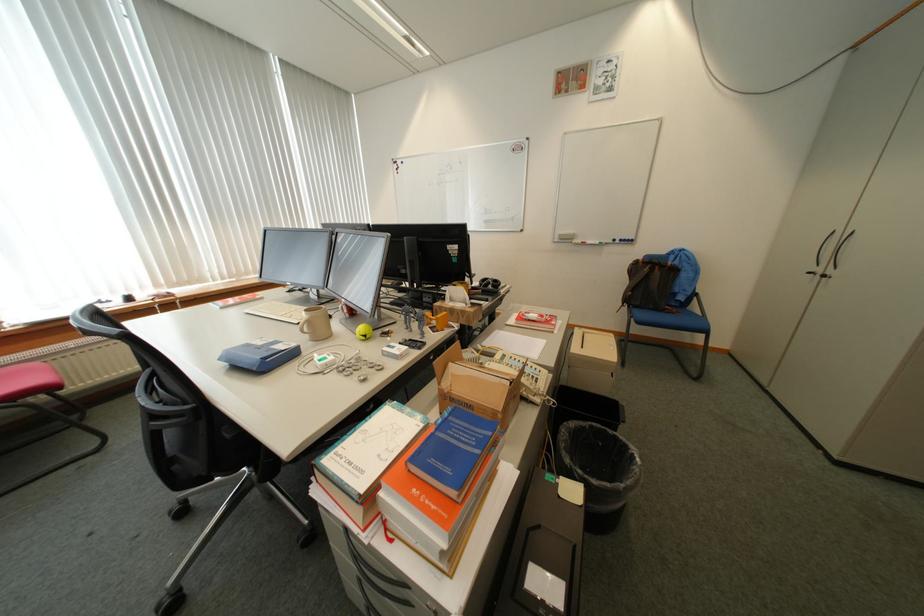
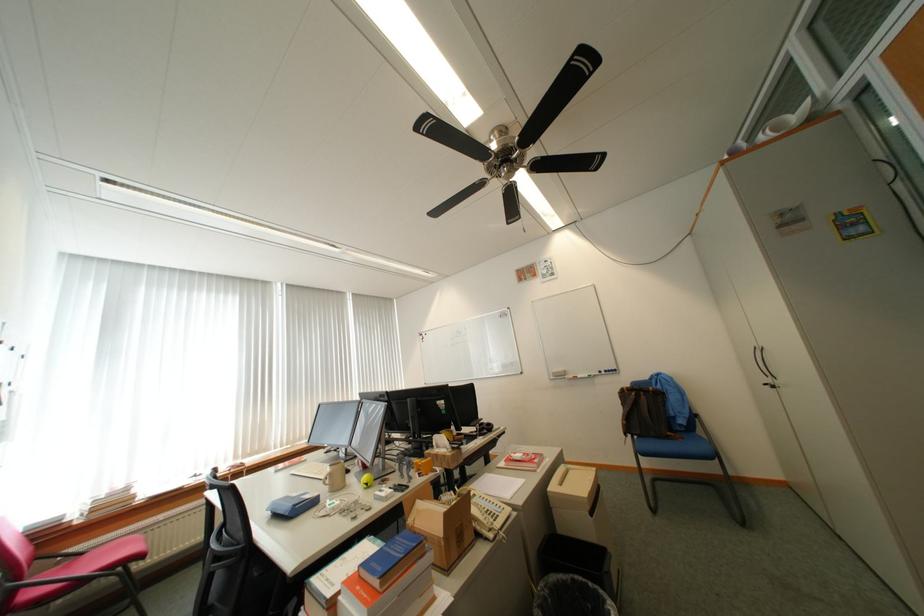
Where in the second image is the point corresponding to [533,394] from the first image?

(488, 530)